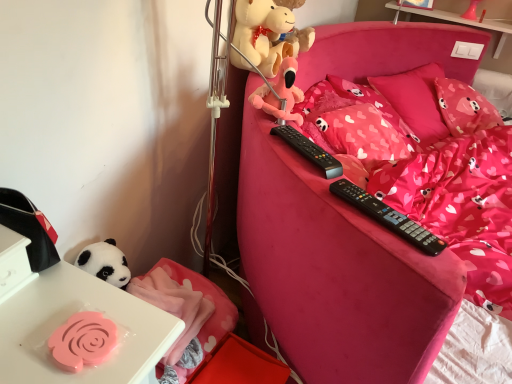
Question: Is pink fabric pillow at upper right, positioned as the 1th pillow in left-to-right order, looking in the opposite direction of white glossy table at upper right?

Choices:
 (A) yes
 (B) no

Answer: (B)

Question: Can you confirm if pink fabric pillow at upper right, positioned as the 1th pillow in left-to-right order, is thinner than white glossy table at upper right?

Choices:
 (A) no
 (B) yes

Answer: (A)

Question: Does pink fabric pillow at upper right, positioned as the 1th pillow in left-to-right order, have a greater height compared to white glossy table at upper right?

Choices:
 (A) no
 (B) yes

Answer: (B)

Question: Is pink fabric pillow at upper right, positioned as the 1th pillow in left-to-right order, facing towards white glossy table at upper right?

Choices:
 (A) yes
 (B) no

Answer: (B)

Question: Is pink fabric pillow at upper right, positioned as the 1th pillow in left-to-right order, not within white glossy table at upper right?

Choices:
 (A) yes
 (B) no

Answer: (A)

Question: Is matte pink plush at upper center inside or outside of pink fabric blanket at lower left?

Choices:
 (A) outside
 (B) inside

Answer: (A)

Question: Is point (264, 109) closer or farther from the camera than point (185, 324)?

Choices:
 (A) closer
 (B) farther

Answer: (B)

Question: In terms of size, does matte pink plush at upper center appear bigger or smaller than pink fabric blanket at lower left?

Choices:
 (A) big
 (B) small

Answer: (B)

Question: From the image's perspective, is matte pink plush at upper center located above or below pink fabric blanket at lower left?

Choices:
 (A) below
 (B) above

Answer: (B)

Question: Relative to soft plush teddy bear at upper center, is pink fabric bed at center in front or behind?

Choices:
 (A) front
 (B) behind

Answer: (A)

Question: Is point (398, 370) closer or farther from the camera than point (272, 13)?

Choices:
 (A) closer
 (B) farther

Answer: (A)

Question: Is pink fabric bed at center situated inside soft plush teddy bear at upper center or outside?

Choices:
 (A) inside
 (B) outside

Answer: (B)

Question: Considering the positions of pink fabric bed at center and soft plush teddy bear at upper center in the image, is pink fabric bed at center wider or thinner than soft plush teddy bear at upper center?

Choices:
 (A) wide
 (B) thin

Answer: (A)

Question: Is pink fabric blanket at lower left wider or thinner than pink fabric bed at center?

Choices:
 (A) wide
 (B) thin

Answer: (B)

Question: Is pink fabric blanket at lower left bigger or smaller than pink fabric bed at center?

Choices:
 (A) small
 (B) big

Answer: (A)